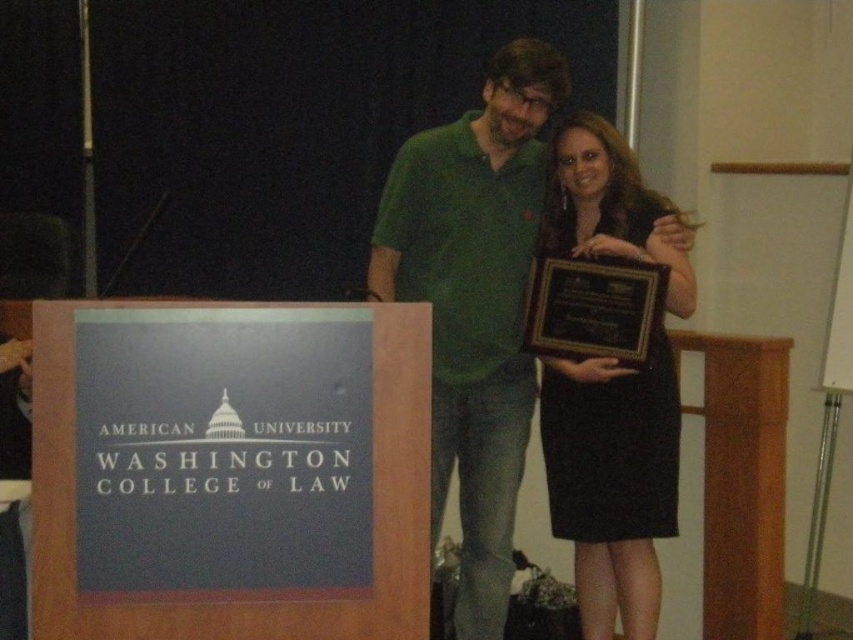
Question: Which of the following is the farthest from the observer?

Choices:
 (A) (538, 339)
 (B) (422, 515)
 (C) (457, 454)

Answer: (C)

Question: Among these points, which one is farthest from the camera?

Choices:
 (A) (601, 150)
 (B) (442, 173)

Answer: (B)

Question: In this image, where is matte green shirt at center located relative to black polished wood plaque at center?

Choices:
 (A) left
 (B) right

Answer: (A)

Question: Considering the relative positions of blue cardboard sign at left and black polished wood plaque at center in the image provided, where is blue cardboard sign at left located with respect to black polished wood plaque at center?

Choices:
 (A) above
 (B) below

Answer: (B)

Question: Which is farther from the black satin dress at center?

Choices:
 (A) black polished wood plaque at center
 (B) matte green shirt at center
 (C) blue cardboard sign at left

Answer: (C)

Question: Does matte green shirt at center appear on the right side of black polished wood plaque at center?

Choices:
 (A) no
 (B) yes

Answer: (A)